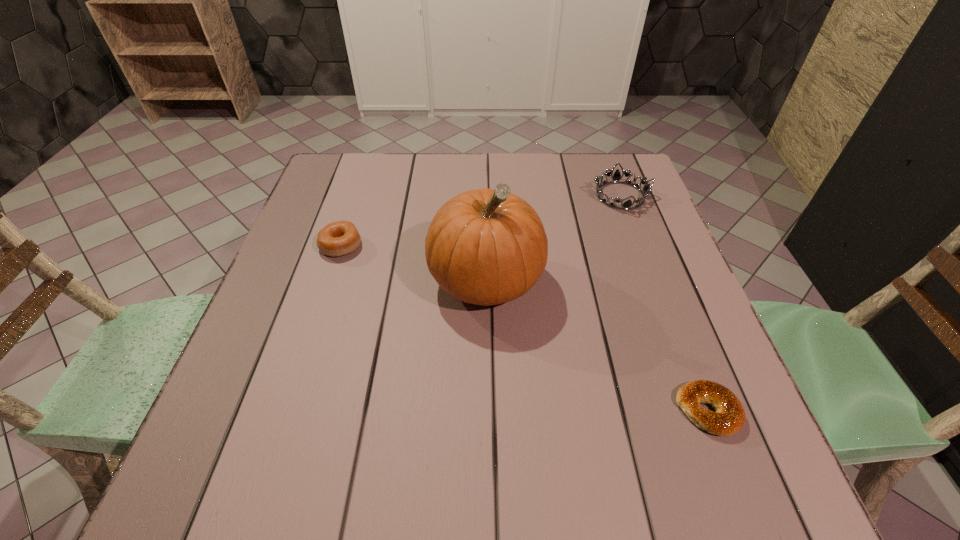
I want to click on free space at the near edge, so click(x=651, y=488).

Image resolution: width=960 pixels, height=540 pixels. In the image, there is a desktop. Find the location of `vacant space at the left edge`. vacant space at the left edge is located at coordinates (302, 253).

Find the location of `vacant region at the right edge`. vacant region at the right edge is located at coordinates (670, 320).

Where is `vacant space at the far left corner`? vacant space at the far left corner is located at coordinates (366, 171).

Locate an element on the screen. vacant region at the far right corner of the desktop is located at coordinates 580,153.

You are a GUI agent. You are given a task and a screenshot of the screen. Output one action in this format:
    pyautogui.click(x=<x>, y=<y>)
    Task: Click on the free space between the nearer bagel and the tiara
    The image size is (960, 540).
    Given the screenshot: What is the action you would take?
    pyautogui.click(x=664, y=303)

Locate an element on the screen. The image size is (960, 540). free area in between the second object from left to right and the taller bagel is located at coordinates (414, 264).

At what (x,y) coordinates should I click in order to perform the action: click on free space between the pumpkin and the third shortest object. Please return your answer as a coordinate pair (x, y). Image resolution: width=960 pixels, height=540 pixels. Looking at the image, I should click on (553, 239).

The height and width of the screenshot is (540, 960). What are the coordinates of `vacant area between the farther bagel and the right bagel` in the screenshot? It's located at (524, 328).

This screenshot has height=540, width=960. I want to click on empty location between the second object from left to right and the shorter bagel, so click(x=597, y=346).